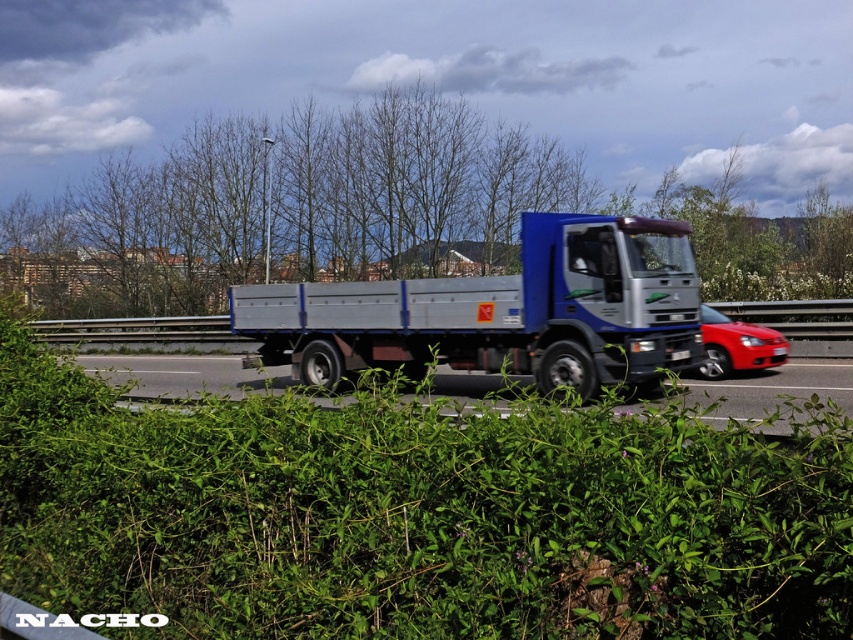
Is point (109, 188) positioned after point (726, 397)?

Yes.

Can you confirm if bare branches at center is positioned to the right of metallic silver truck at center?

In fact, bare branches at center is to the left of metallic silver truck at center.

In order to click on bare branches at center in this screenshot , I will do `click(506, 202)`.

Find the location of a particular element. bare branches at center is located at coordinates point(506,202).

The height and width of the screenshot is (640, 853). Describe the element at coordinates (415, 515) in the screenshot. I see `green leafy hedge at center` at that location.

Is green leafy hedge at center below shiny red car at right?

Yes.

Is point (532, 445) positioned after point (717, 349)?

No.

This screenshot has height=640, width=853. Identify the location of green leafy hedge at center. (415, 515).

Does metallic silver trailer truck at center have a lesser width compared to shiny red car at right?

No.

Describe the element at coordinates (502, 310) in the screenshot. I see `metallic silver trailer truck at center` at that location.

Where is `metallic silver trailer truck at center`? The width and height of the screenshot is (853, 640). metallic silver trailer truck at center is located at coordinates (502, 310).